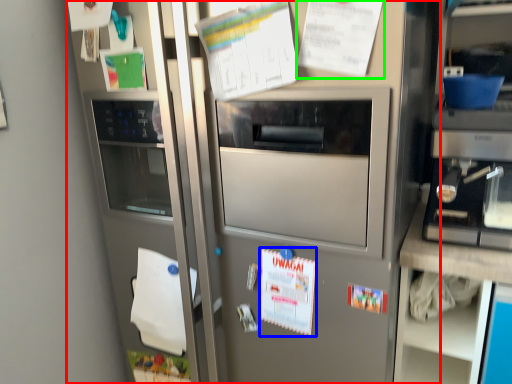
Question: Based on their relative distances, which object is farther from fridge (highlighted by a red box)? Choose from poster (highlighted by a blue box) and poster (highlighted by a green box).

Choices:
 (A) poster
 (B) poster

Answer: (B)